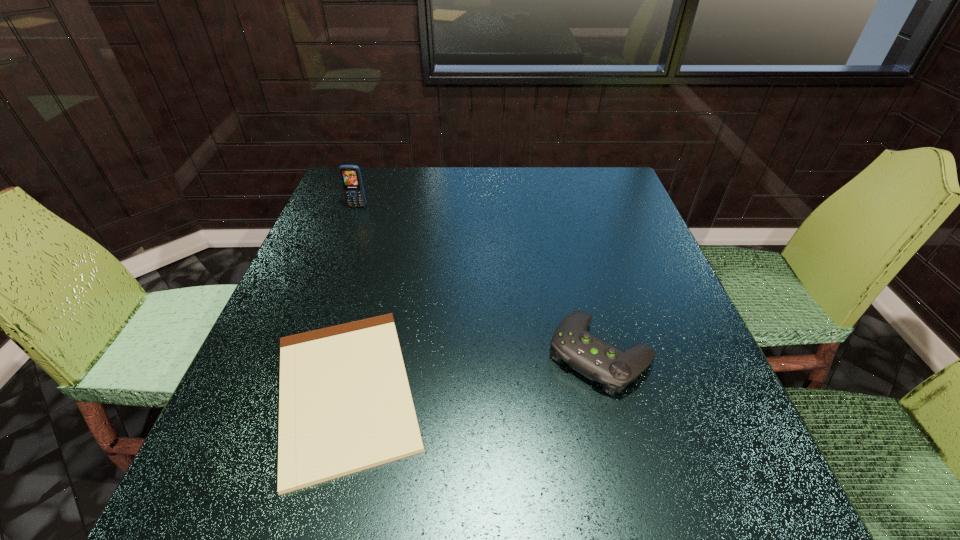
The width and height of the screenshot is (960, 540). Identify the location of unoccupied area between the shortest object and the rightmost object. (472, 372).

This screenshot has width=960, height=540. What are the coordinates of `unoccupied position between the control and the shortest object` in the screenshot? It's located at (472, 372).

I want to click on vacant space in between the tallest object and the shortest object, so click(x=351, y=299).

Where is `blank region between the second shortest object and the clipboard`? The width and height of the screenshot is (960, 540). blank region between the second shortest object and the clipboard is located at coordinates (472, 372).

I want to click on free space between the control and the clipboard, so click(x=472, y=372).

In order to click on unoccupied area between the farthest object and the clipboard in this screenshot , I will do `click(351, 299)`.

Where is `unoccupied position between the tallest object and the rightmost object`? This screenshot has height=540, width=960. unoccupied position between the tallest object and the rightmost object is located at coordinates (478, 280).

Find the location of a particular element. This screenshot has height=540, width=960. free space between the clipboard and the farthest object is located at coordinates (351, 299).

Where is `vacant area that lies between the rightmost object and the cellular telephone`? The height and width of the screenshot is (540, 960). vacant area that lies between the rightmost object and the cellular telephone is located at coordinates (478, 280).

You are a GUI agent. You are given a task and a screenshot of the screen. Output one action in this format:
    pyautogui.click(x=<x>, y=<y>)
    Task: Click on the free space between the cellular telephone and the clipboard
    
    Given the screenshot: What is the action you would take?
    pyautogui.click(x=351, y=299)